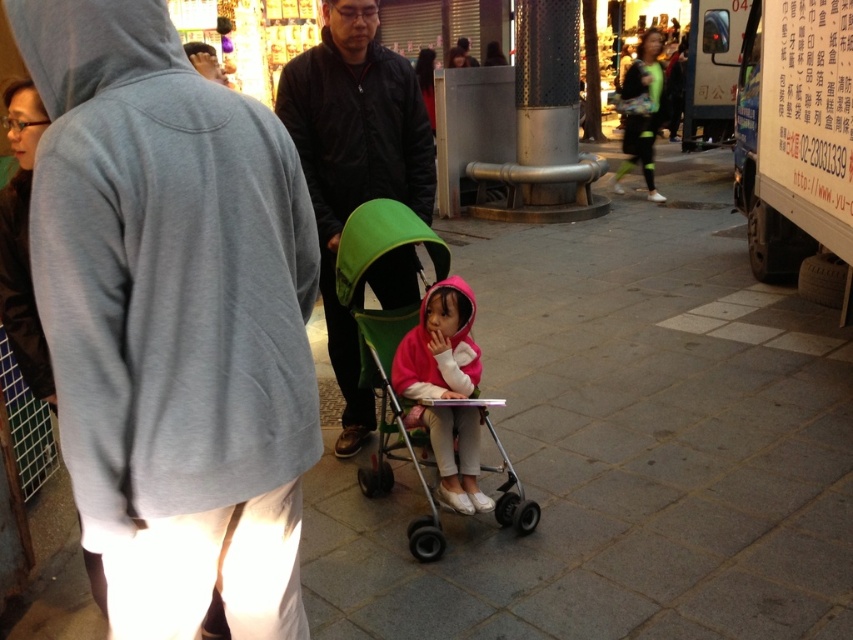
Does point (302, 104) come behind point (431, 49)?

No, (302, 104) is closer to viewer.

Is point (364, 152) positioned behind point (432, 109)?

That is False.

Image resolution: width=853 pixels, height=640 pixels. In order to click on dark brown leather jacket at center in this screenshot , I will do `click(354, 163)`.

Locate an element on the screen. The width and height of the screenshot is (853, 640). dark brown leather jacket at center is located at coordinates (354, 163).

Is dark brown leather jacket at center further to the viewer compared to green fabric stroller at center?

Yes, dark brown leather jacket at center is further from the viewer.

Where is `dark brown leather jacket at center`? The image size is (853, 640). dark brown leather jacket at center is located at coordinates (354, 163).

You are a GUI agent. You are given a task and a screenshot of the screen. Output one action in this format:
    pyautogui.click(x=<x>, y=<y>)
    Task: Click on the dark brown leather jacket at center
    Image resolution: width=853 pixels, height=640 pixels.
    Given the screenshot: What is the action you would take?
    pyautogui.click(x=354, y=163)

Is point (20, 369) in front of point (427, 51)?

Yes, point (20, 369) is closer to viewer.

At what (x,y) coordinates should I click in order to perform the action: click on dark brown fur coat at left. Please return your answer as a coordinate pair (x, y). The height and width of the screenshot is (640, 853). Looking at the image, I should click on (22, 243).

Locate an element on the screen. dark brown fur coat at left is located at coordinates (22, 243).

Where is `dark brown fur coat at left`? The width and height of the screenshot is (853, 640). dark brown fur coat at left is located at coordinates (22, 243).